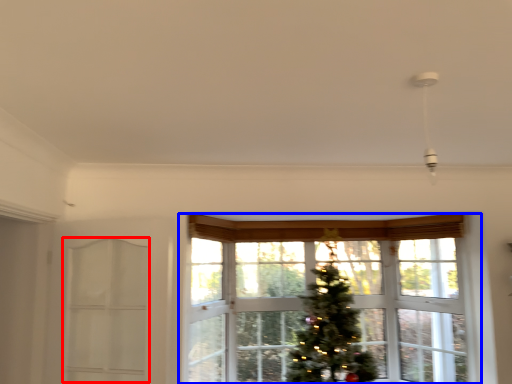
Question: Which of the following is the closest to the observer, screen door (highlighted by a red box) or window (highlighted by a blue box)?

Choices:
 (A) screen door
 (B) window

Answer: (A)